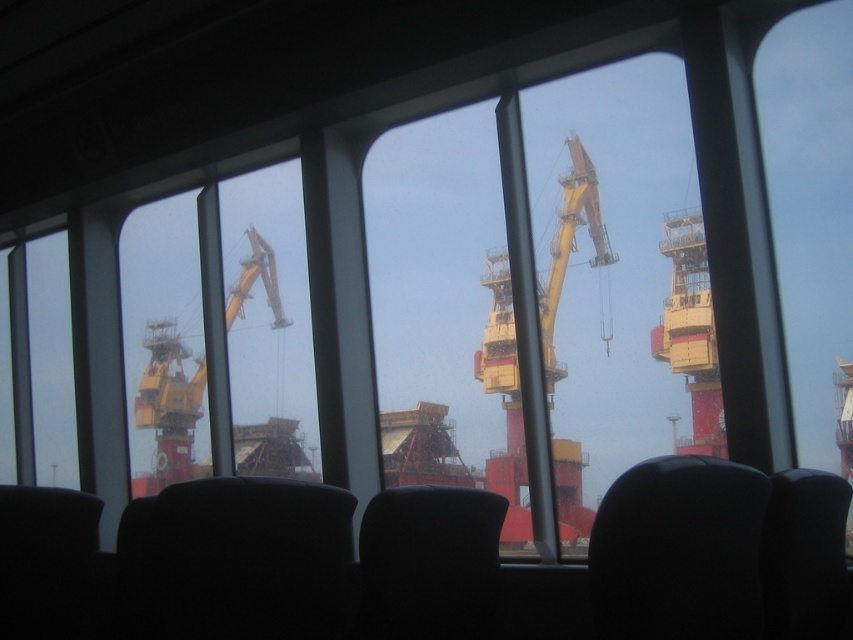
You are standing inside the ship and looking through the windows. There are two points marked on the window panes at coordinates point (131, 557) and point (474, 378). Which point is closer to you when you look through the window?

Point (131, 557) is in front of point (474, 378), so it is closer to you.

You are sitting in the room and want to see the yellow metallic crane at center through the window. Is the matte black chair at lower left blocking your view of the crane?

The matte black chair at lower left has a lesser height compared to yellow metallic crane at center, so the chair is shorter than the crane. Since the chair is lower, it won not block your view of the crane through the window.

You are sitting in the room and want to look out the window to the yellow metallic crane at center. Is the matte black chair at lower left blocking your view of the crane?

The matte black chair at lower left is closer to the viewer than the yellow metallic crane at center, so the chair would block your view of the crane.